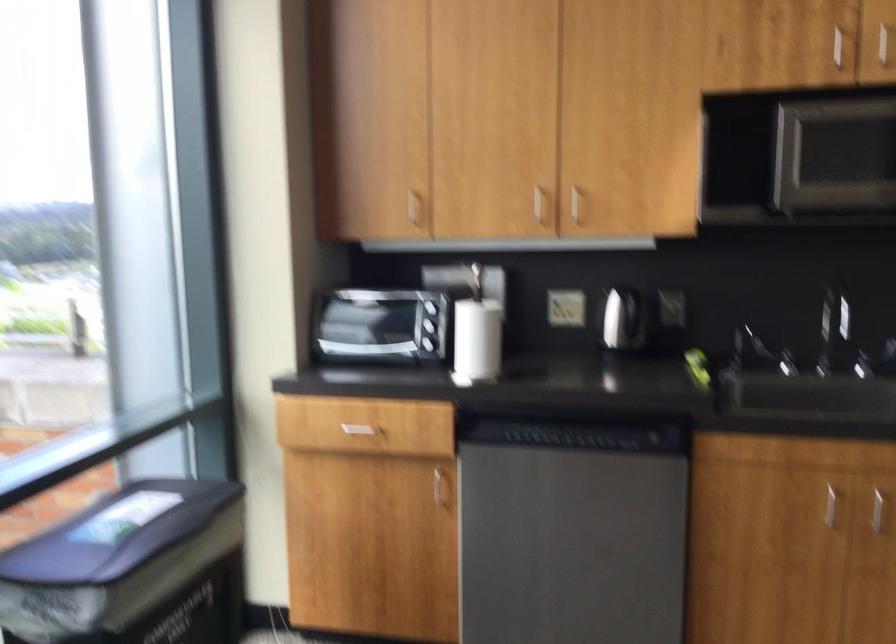
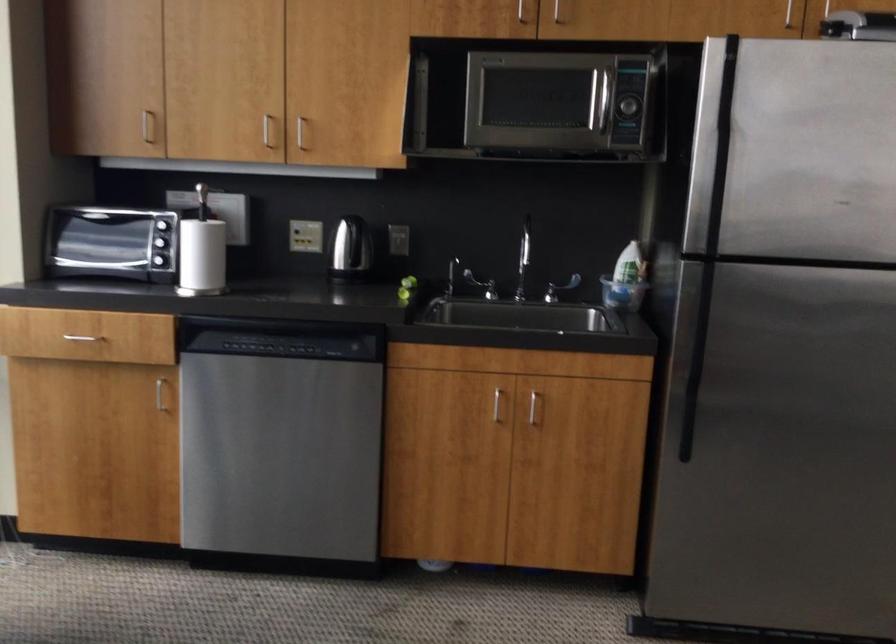
Find the pixel in the second image that matches the point at 558,438 in the first image.

(277, 346)